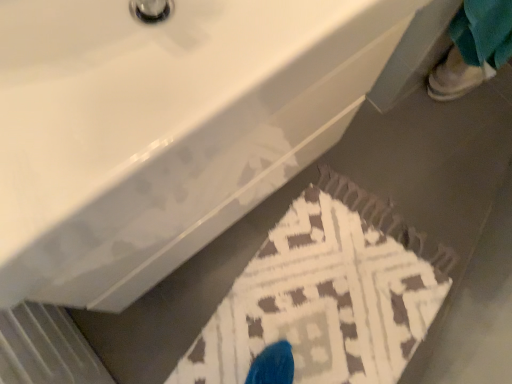
Locate an element on the screen. vacant space that is in between white leather shoe at upper right and brown textured rug at lower center is located at coordinates (421, 156).